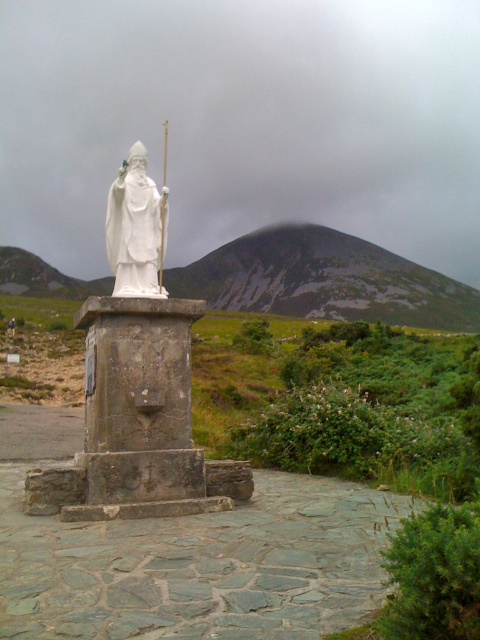
Question: Which object appears closest to the camera in this image?

Choices:
 (A) white porcelain statue at center
 (B) white stone statue at center

Answer: (A)

Question: Is white porcelain statue at center above white stone statue at center?

Choices:
 (A) yes
 (B) no

Answer: (A)

Question: Which point is closer to the camera taking this photo?

Choices:
 (A) (11, 326)
 (B) (108, 228)

Answer: (B)

Question: Does white porcelain statue at center have a greater width compared to white stone statue at center?

Choices:
 (A) no
 (B) yes

Answer: (A)

Question: Can you confirm if white porcelain statue at center is positioned to the left of white stone statue at center?

Choices:
 (A) yes
 (B) no

Answer: (B)